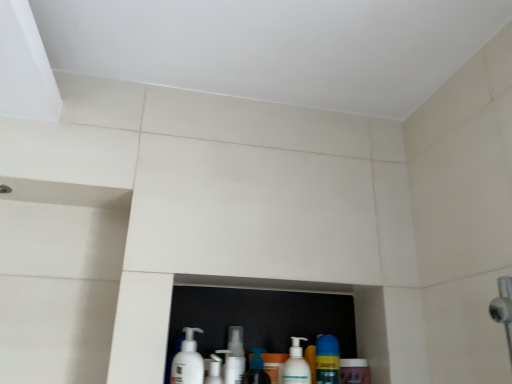
Question: Is translucent plastic soap dispenser at center, acting as the 3th cleaning product starting from the right, positioned far away from white matte pump bottle at lower center, the 1th cleaning product from the left?

Choices:
 (A) yes
 (B) no

Answer: (B)

Question: Considering the relative sizes of translucent plastic soap dispenser at center, which is counted as the third cleaning product, starting from the left, and white matte pump bottle at lower center, the 1th cleaning product from the left, in the image provided, is translucent plastic soap dispenser at center, which is counted as the third cleaning product, starting from the left, bigger than white matte pump bottle at lower center, the 1th cleaning product from the left,?

Choices:
 (A) no
 (B) yes

Answer: (A)

Question: Is translucent plastic soap dispenser at center, which is counted as the third cleaning product, starting from the left, behind white matte pump bottle at lower center, the 1th cleaning product from the left?

Choices:
 (A) no
 (B) yes

Answer: (B)

Question: Considering the relative positions of translucent plastic soap dispenser at center, which is counted as the third cleaning product, starting from the left, and white matte pump bottle at lower center, the 5th cleaning product when ordered from right to left, in the image provided, is translucent plastic soap dispenser at center, which is counted as the third cleaning product, starting from the left, in front of white matte pump bottle at lower center, the 5th cleaning product when ordered from right to left,?

Choices:
 (A) no
 (B) yes

Answer: (A)

Question: Does translucent plastic soap dispenser at center, which is counted as the third cleaning product, starting from the left, have a lesser height compared to white matte pump bottle at lower center, the 1th cleaning product from the left?

Choices:
 (A) no
 (B) yes

Answer: (B)

Question: In the image, is white plastic cup at center, which is the 2th cleaning product in left-to-right order, on the left side or the right side of white matte pump bottle at lower center, the 1th cleaning product from the left?

Choices:
 (A) left
 (B) right

Answer: (B)

Question: Is white plastic cup at center, the fourth cleaning product when ordered from right to left, in front of or behind white matte pump bottle at lower center, the 5th cleaning product when ordered from right to left, in the image?

Choices:
 (A) front
 (B) behind

Answer: (B)

Question: Is white plastic cup at center, the fourth cleaning product when ordered from right to left, wider or thinner than white matte pump bottle at lower center, the 1th cleaning product from the left?

Choices:
 (A) thin
 (B) wide

Answer: (A)

Question: From a real-world perspective, is white plastic cup at center, the fourth cleaning product when ordered from right to left, physically located above or below white matte pump bottle at lower center, the 1th cleaning product from the left?

Choices:
 (A) below
 (B) above

Answer: (A)

Question: Looking at the image, does white plastic pump bottle at lower center, the 2th cleaning product viewed from the right, seem bigger or smaller compared to white matte pump bottle at lower center, the 5th cleaning product when ordered from right to left?

Choices:
 (A) small
 (B) big

Answer: (A)

Question: Is white plastic pump bottle at lower center, the 2th cleaning product viewed from the right, in front of or behind white matte pump bottle at lower center, the 5th cleaning product when ordered from right to left, in the image?

Choices:
 (A) behind
 (B) front

Answer: (A)

Question: Considering the positions of point (293, 377) and point (196, 380), is point (293, 377) closer or farther from the camera than point (196, 380)?

Choices:
 (A) closer
 (B) farther

Answer: (B)

Question: In the image, is white plastic pump bottle at lower center, the 2th cleaning product viewed from the right, on the left side or the right side of white matte pump bottle at lower center, the 5th cleaning product when ordered from right to left?

Choices:
 (A) right
 (B) left

Answer: (A)

Question: From a real-world perspective, is yellow matte bottle at lower center, the 5th cleaning product when ordered from left to right, physically located above or below translucent plastic soap dispenser at center, acting as the 3th cleaning product starting from the right?

Choices:
 (A) above
 (B) below

Answer: (A)

Question: Is point (321, 370) closer or farther from the camera than point (248, 370)?

Choices:
 (A) farther
 (B) closer

Answer: (B)